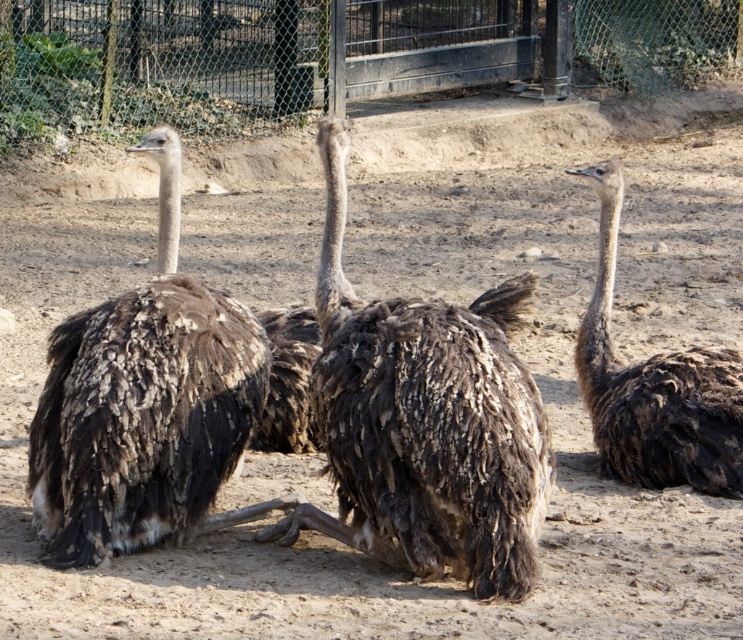
Question: Based on their relative distances, which object is farther from the dark brown feathered ostrich at left?

Choices:
 (A) metallic chain-link fence at upper center
 (B) brown fuzzy ostrich at center
 (C) brown fuzzy ostrich at right

Answer: (A)

Question: Among these points, which one is nearest to the camera?

Choices:
 (A) (84, 8)
 (B) (212, 323)

Answer: (B)

Question: Can you confirm if metallic chain-link fence at upper center is smaller than dark brown feathered ostrich at left?

Choices:
 (A) no
 (B) yes

Answer: (B)

Question: Which point is closer to the camera?

Choices:
 (A) (674, 355)
 (B) (1, 145)

Answer: (A)

Question: Does brown fuzzy ostrich at center lie behind dark brown feathered ostrich at left?

Choices:
 (A) yes
 (B) no

Answer: (B)

Question: Is dark brown feathered ostrich at left smaller than brown fuzzy ostrich at right?

Choices:
 (A) yes
 (B) no

Answer: (B)